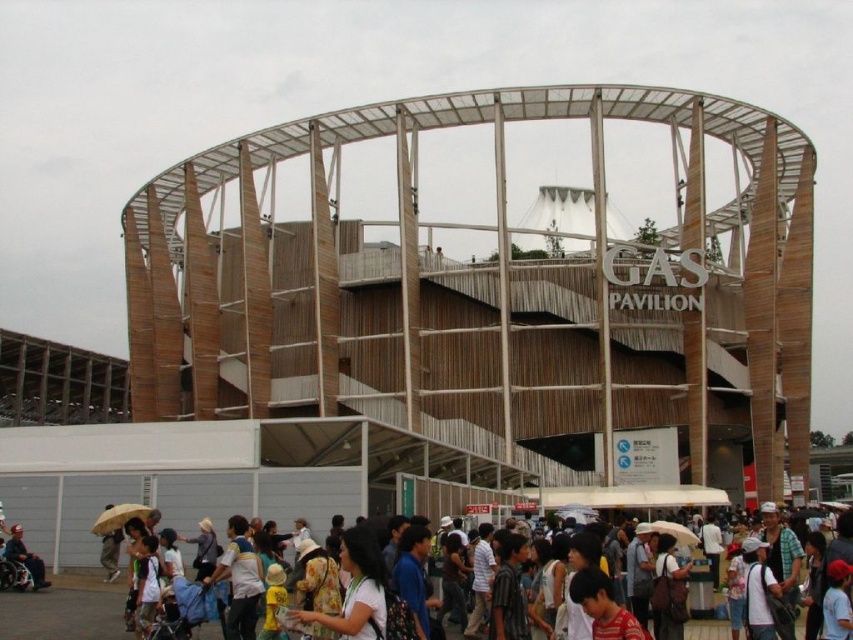
The image size is (853, 640). Identify the location of dark gray fabric wheelchair at lower left. (25, 557).

Which is more to the left, dark gray fabric wheelchair at lower left or yellow matte umbrella at lower left?

dark gray fabric wheelchair at lower left

Locate an element on the screen. dark gray fabric wheelchair at lower left is located at coordinates (25, 557).

Find the location of `dark gray fabric wheelchair at lower left`. dark gray fabric wheelchair at lower left is located at coordinates (25, 557).